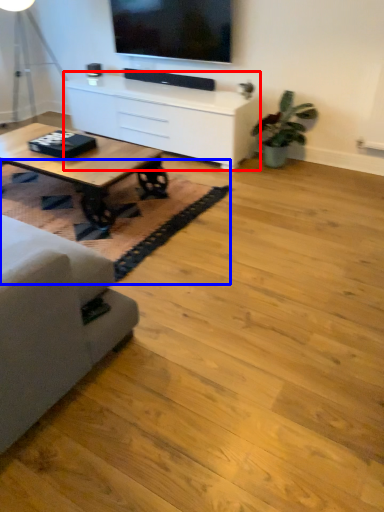
Question: Which of the following is the closest to the observer, table (highlighted by a red box) or mat (highlighted by a blue box)?

Choices:
 (A) table
 (B) mat

Answer: (B)